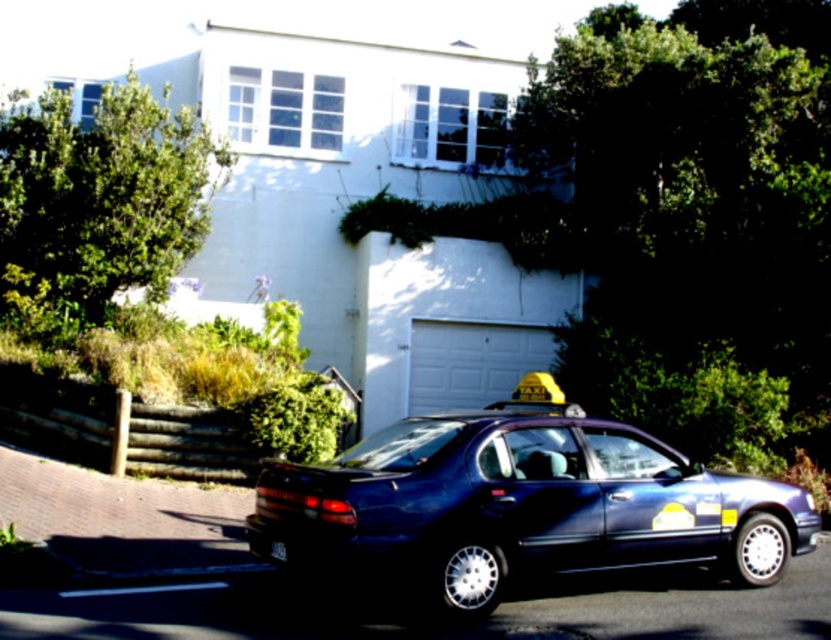
You are a delivery person trying to secure a package on top of the yellow rubber taxi at center. You have a measuring tape and notice the black plastic license plate at lower center. Can you place the package on the roof without it touching the license plate?

The yellow rubber taxi at center has a greater height compared to the black plastic license plate at lower center. Therefore, the package can be placed on the roof without touching the license plate as the taxi is taller than the license plate.

You are a delivery person trying to park your van next to the yellow rubber taxi at center and the black plastic license plate at lower center. Is there enough space between them to fit your van?

The yellow rubber taxi at center is larger in size than the black plastic license plate at lower center, but the exact distance between them isn not specified. Without knowing the distance, it is impossible to determine if there is enough space for your van.

You are a pedestrian standing on the sidewalk in front of the house. You see the glossy blue sedan at center and the black plastic license plate at lower center. Which object is positioned more to the left?

The black plastic license plate at lower center is positioned more to the left because the glossy blue sedan at center is to its right.